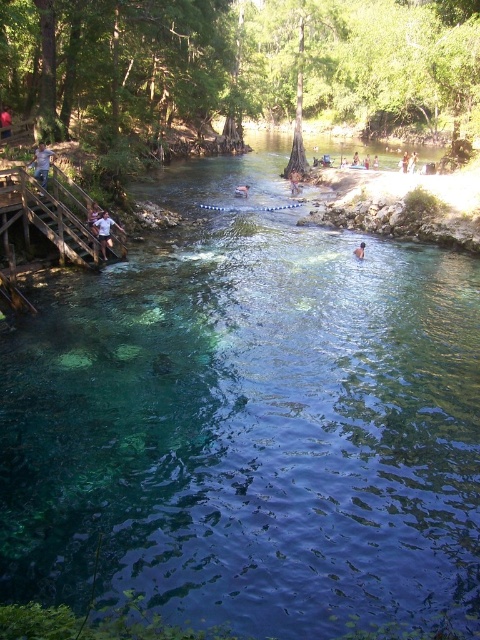
From the picture: You are a photographer standing at the top of the wooden staircase. You want to capture a photo of the light blue denim jeans at left and the brown hair at center in the same frame. Based on their positions, which object should appear higher in your photo?

The light blue denim jeans at left should appear higher in the photo because it is positioned above the brown hair at center.

You are a photographer positioned at the riverbank and want to capture a photo of the light blue denim jeans at left and the red shirt at left. Which object should be placed closer to the camera to ensure both appear in the frame without overlapping?

The light blue denim jeans at left might be wider than red shirt at left, so placing the light blue denim jeans at left closer to the camera would help prevent overlap while ensuring both are in the frame.

Looking at this image, you are a photographer trying to capture a candid shot of the scene. You notice the brown leather jacket at center and the brown hair at center. Which object should you focus on to ensure it appears larger in your photo?

The brown leather jacket at center has a greater height compared to the brown hair at center, so focusing on it will result in a larger appearance in the photo.